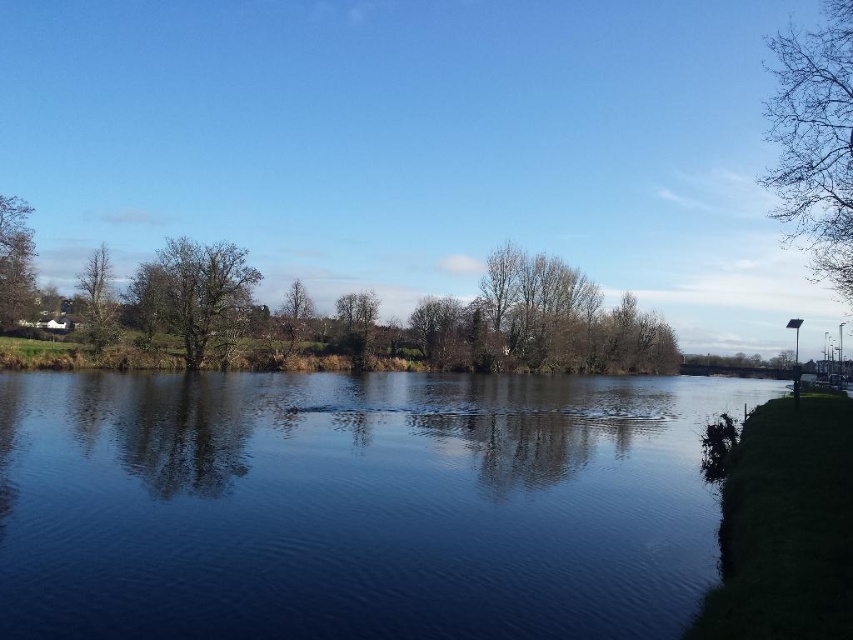
You are standing at the edge of the riverside scene. You want to find the blue reflective water at center. According to the coordinates provided, in which direction should you look relative to your position?

The blue reflective water at center is located at coordinates point (x=357, y=504). Since the coordinates are given as x,y, the first value represents the horizontal axis and the second the vertical. A value of 0.789 on the x axis indicates it is to the right side of the image, while 0.419 on the y axis places it towards the lower half. Therefore, you should look towards the lower right direction from your current position at the riverside edge.

You are a bird looking for a place to perch. You see a green leafy tree at left and bare branches at center. Which one is taller?

The green leafy tree at left is taller than the bare branches at center, so you should choose the green leafy tree at left for perching.